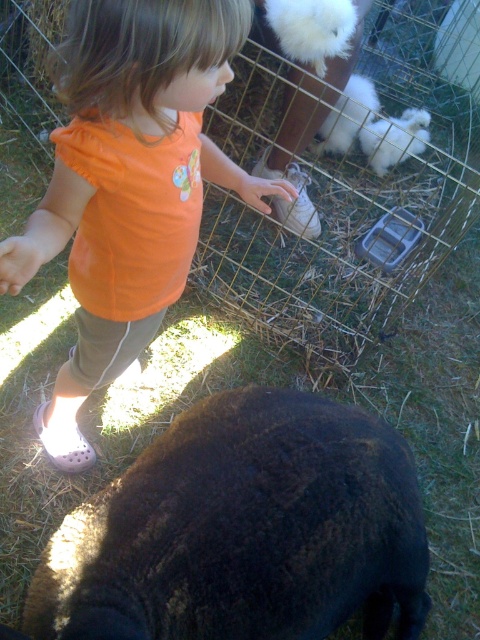
Question: Does black woolen sheep at lower left appear over orange cotton shirt at center?

Choices:
 (A) no
 (B) yes

Answer: (A)

Question: Which object is farther from the camera taking this photo?

Choices:
 (A) orange cotton shirt at center
 (B) black woolen sheep at lower left

Answer: (B)

Question: Which of the following is the farthest from the observer?

Choices:
 (A) black woolen sheep at lower left
 (B) orange cotton shirt at center

Answer: (A)

Question: Is black woolen sheep at lower left above orange cotton shirt at center?

Choices:
 (A) yes
 (B) no

Answer: (B)

Question: Does black woolen sheep at lower left have a lesser width compared to orange cotton shirt at center?

Choices:
 (A) yes
 (B) no

Answer: (B)

Question: Which point is farther to the camera?

Choices:
 (A) orange cotton shirt at center
 (B) black woolen sheep at lower left

Answer: (B)